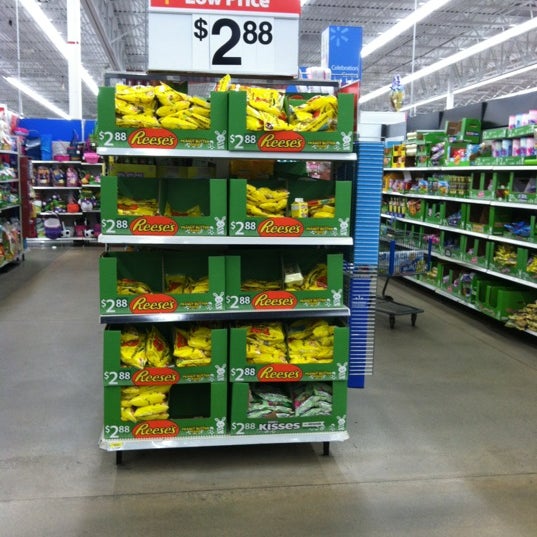
Identify the location of gray tiled floor. The height and width of the screenshot is (537, 537). (50, 439).